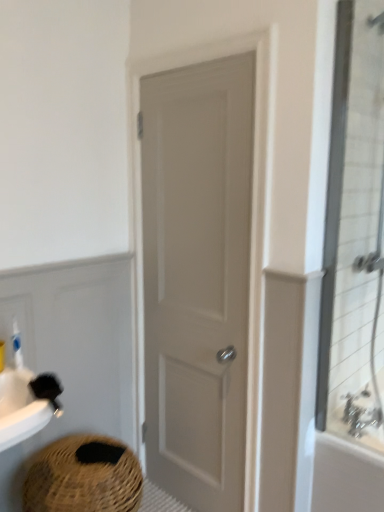
Question: From the image's perspective, would you say white matte door at center is positioned over silver metallic faucet at upper right?

Choices:
 (A) no
 (B) yes

Answer: (B)

Question: Does white matte door at center have a greater width compared to silver metallic faucet at upper right?

Choices:
 (A) yes
 (B) no

Answer: (A)

Question: From a real-world perspective, is white matte door at center located beneath silver metallic faucet at upper right?

Choices:
 (A) yes
 (B) no

Answer: (B)

Question: Considering the relative sizes of white matte door at center and silver metallic faucet at upper right in the image provided, is white matte door at center bigger than silver metallic faucet at upper right?

Choices:
 (A) no
 (B) yes

Answer: (B)

Question: Is white matte door at center further to camera compared to silver metallic faucet at upper right?

Choices:
 (A) yes
 (B) no

Answer: (B)

Question: Can you confirm if white matte door at center is smaller than silver metallic faucet at upper right?

Choices:
 (A) yes
 (B) no

Answer: (B)

Question: Is silver metallic faucet at upper right further to the viewer compared to silver metallic faucet at upper right?

Choices:
 (A) no
 (B) yes

Answer: (B)

Question: Is silver metallic faucet at upper right at the right side of silver metallic faucet at upper right?

Choices:
 (A) yes
 (B) no

Answer: (A)

Question: Can you confirm if silver metallic faucet at upper right is shorter than silver metallic faucet at upper right?

Choices:
 (A) no
 (B) yes

Answer: (A)

Question: Does silver metallic faucet at upper right have a greater width compared to silver metallic faucet at upper right?

Choices:
 (A) yes
 (B) no

Answer: (A)

Question: Is silver metallic faucet at upper right placed right next to silver metallic faucet at upper right?

Choices:
 (A) yes
 (B) no

Answer: (A)

Question: From the image's perspective, is silver metallic faucet at upper right below silver metallic faucet at upper right?

Choices:
 (A) no
 (B) yes

Answer: (A)

Question: Considering the relative sizes of silver metallic faucet at upper right and braided straw basket at lower left in the image provided, is silver metallic faucet at upper right smaller than braided straw basket at lower left?

Choices:
 (A) yes
 (B) no

Answer: (A)